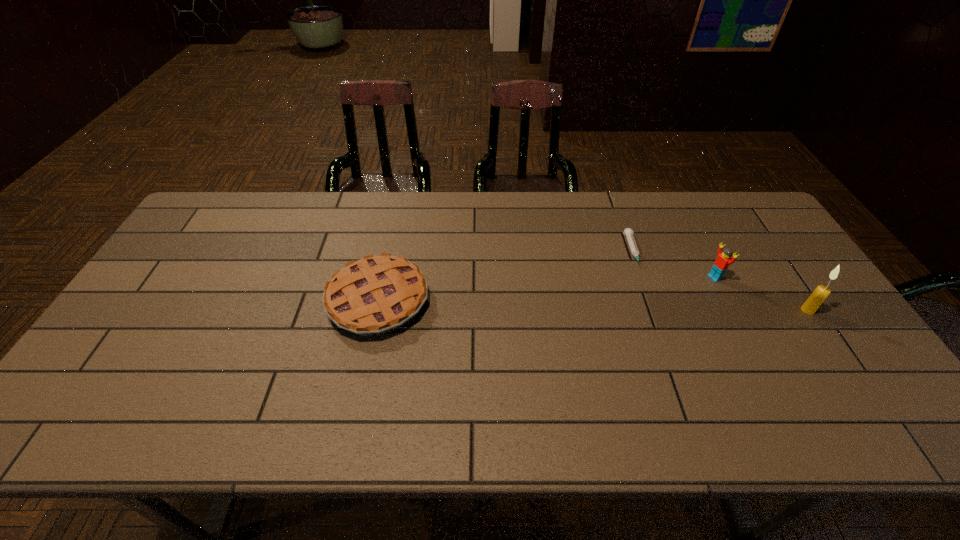
This screenshot has width=960, height=540. I want to click on the third tallest object, so click(377, 294).

Locate an element on the screen. The height and width of the screenshot is (540, 960). pie is located at coordinates (377, 294).

The width and height of the screenshot is (960, 540). I want to click on candle, so click(811, 305).

Where is `the tallest object`? The width and height of the screenshot is (960, 540). the tallest object is located at coordinates (811, 305).

At what (x,y) coordinates should I click in order to perform the action: click on the third object from left to right. Please return your answer as a coordinate pair (x, y). This screenshot has width=960, height=540. Looking at the image, I should click on (723, 260).

The height and width of the screenshot is (540, 960). In order to click on the second tallest object in this screenshot , I will do `click(723, 260)`.

This screenshot has height=540, width=960. I want to click on the second object from left to right, so click(628, 232).

At what (x,y) coordinates should I click in order to perform the action: click on the shortest object. Please return your answer as a coordinate pair (x, y). Looking at the image, I should click on (628, 232).

Image resolution: width=960 pixels, height=540 pixels. I want to click on free point located 0.180m on the left of the pie, so click(262, 301).

I want to click on free space located 0.230m on the front of the candle, so [x=862, y=392].